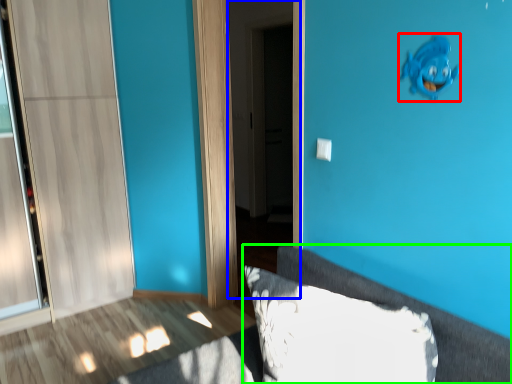
Question: Estimate the real-world distances between objects in this image. Which object is farther from animal (highlighted by a red box), screen door (highlighted by a blue box) or furniture (highlighted by a green box)?

Choices:
 (A) screen door
 (B) furniture

Answer: (A)